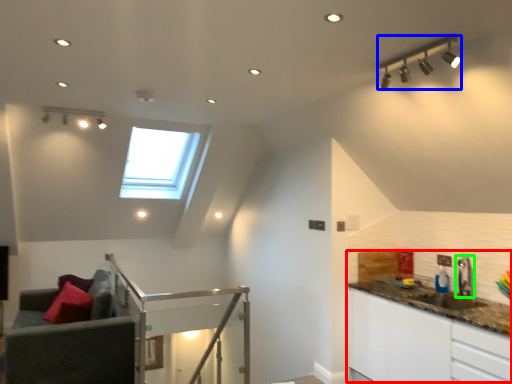
Question: Which is nearer to the counter top (highlighted by a red box)? light fixture (highlighted by a blue box) or tap (highlighted by a green box).

Choices:
 (A) light fixture
 (B) tap

Answer: (B)